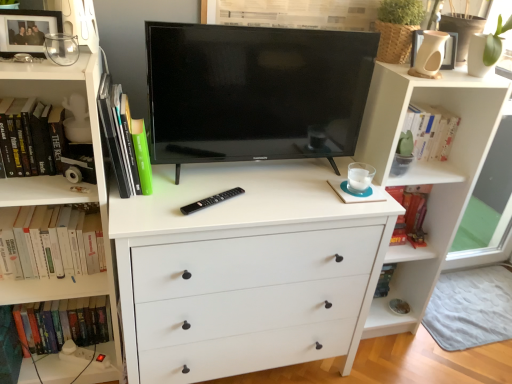
Where is `unoccupied area behind black plastic remote control at center`? Image resolution: width=512 pixels, height=384 pixels. unoccupied area behind black plastic remote control at center is located at coordinates (217, 180).